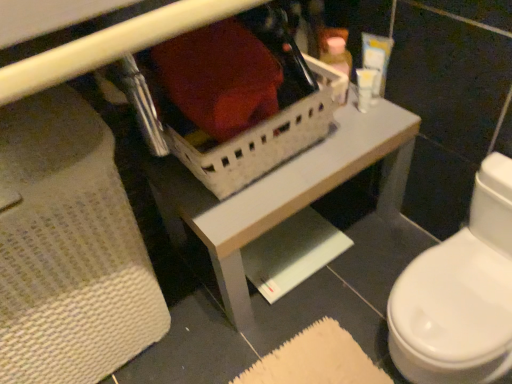
Question: Can you confirm if white plastic basket at center is bigger than white plastic container at upper center, positioned as the 3th toiletry in right-to-left order?

Choices:
 (A) no
 (B) yes

Answer: (B)

Question: Does white plastic basket at center have a greater width compared to white plastic container at upper center, marked as the 1th toiletry in a left-to-right arrangement?

Choices:
 (A) yes
 (B) no

Answer: (A)

Question: Are white plastic basket at center and white plastic container at upper center, positioned as the 3th toiletry in right-to-left order, beside each other?

Choices:
 (A) yes
 (B) no

Answer: (B)

Question: Does white plastic basket at center have a lesser height compared to white plastic container at upper center, marked as the 1th toiletry in a left-to-right arrangement?

Choices:
 (A) no
 (B) yes

Answer: (A)

Question: Is white plastic basket at center facing away from white plastic container at upper center, marked as the 1th toiletry in a left-to-right arrangement?

Choices:
 (A) yes
 (B) no

Answer: (B)

Question: Is white plastic container at upper center, positioned as the 3th toiletry in right-to-left order, taller or shorter than white plastic container at upper right, placed as the 2th toiletry when sorted from left to right?

Choices:
 (A) tall
 (B) short

Answer: (A)

Question: In terms of size, does white plastic container at upper center, positioned as the 3th toiletry in right-to-left order, appear bigger or smaller than white plastic container at upper right, placed as the 2th toiletry when sorted from left to right?

Choices:
 (A) big
 (B) small

Answer: (A)

Question: Is white plastic container at upper center, positioned as the 3th toiletry in right-to-left order, situated inside white plastic container at upper right, the 2th toiletry when ordered from right to left, or outside?

Choices:
 (A) inside
 (B) outside

Answer: (B)

Question: Is white plastic container at upper center, positioned as the 3th toiletry in right-to-left order, in front of or behind white plastic container at upper right, placed as the 2th toiletry when sorted from left to right, in the image?

Choices:
 (A) front
 (B) behind

Answer: (A)

Question: Choose the correct answer: Is white plastic container at upper right, the 2th toiletry when ordered from right to left, inside white plastic basket at center or outside it?

Choices:
 (A) outside
 (B) inside

Answer: (A)

Question: In terms of width, does white plastic container at upper right, the 2th toiletry when ordered from right to left, look wider or thinner when compared to white plastic basket at center?

Choices:
 (A) wide
 (B) thin

Answer: (B)

Question: Based on their positions, is white plastic container at upper right, placed as the 2th toiletry when sorted from left to right, located to the left or right of white plastic basket at center?

Choices:
 (A) right
 (B) left

Answer: (A)

Question: Is point (358, 91) closer or farther from the camera than point (403, 137)?

Choices:
 (A) farther
 (B) closer

Answer: (A)

Question: Considering their positions, is white plastic basket at center located in front of or behind white plastic container at upper right, marked as the third toiletry in a left-to-right arrangement?

Choices:
 (A) behind
 (B) front

Answer: (B)

Question: From their relative heights in the image, would you say white plastic basket at center is taller or shorter than white plastic container at upper right, placed as the 1th toiletry when sorted from right to left?

Choices:
 (A) tall
 (B) short

Answer: (A)